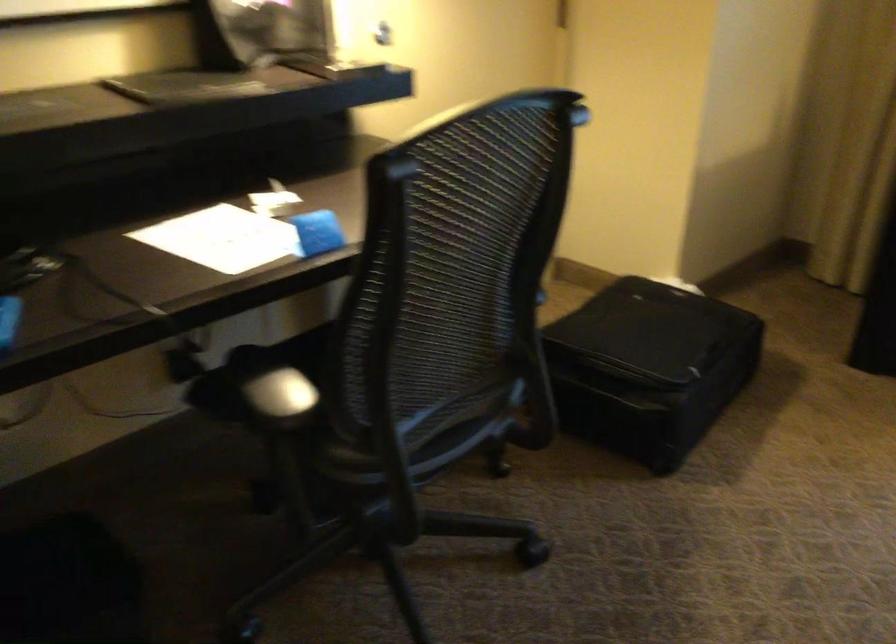
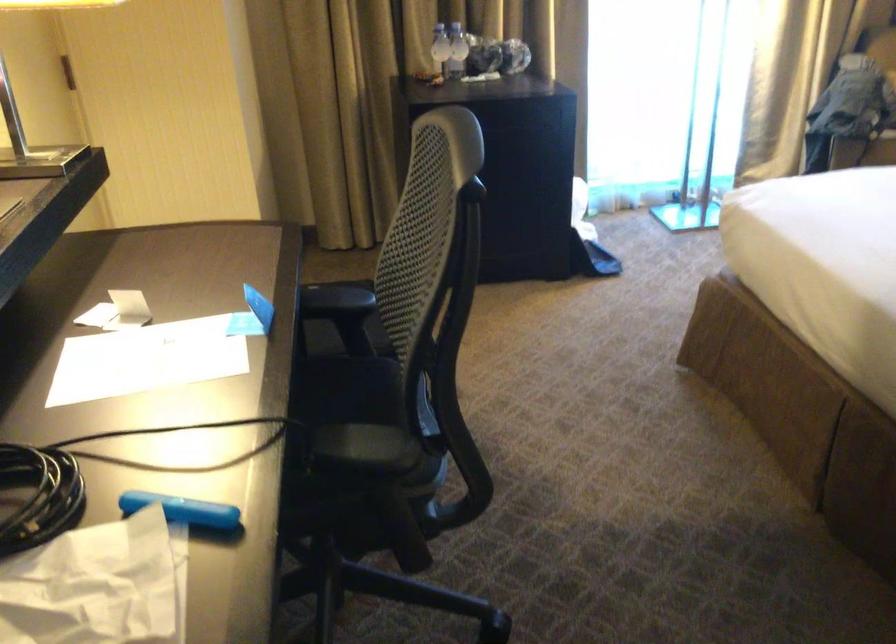
Question: The camera is either moving clockwise (left) or counter-clockwise (right) around the object. The first image is from the beginning of the video and the second image is from the end. Is the camera moving left or right when shooting the video?

Choices:
 (A) Left
 (B) Right

Answer: (A)